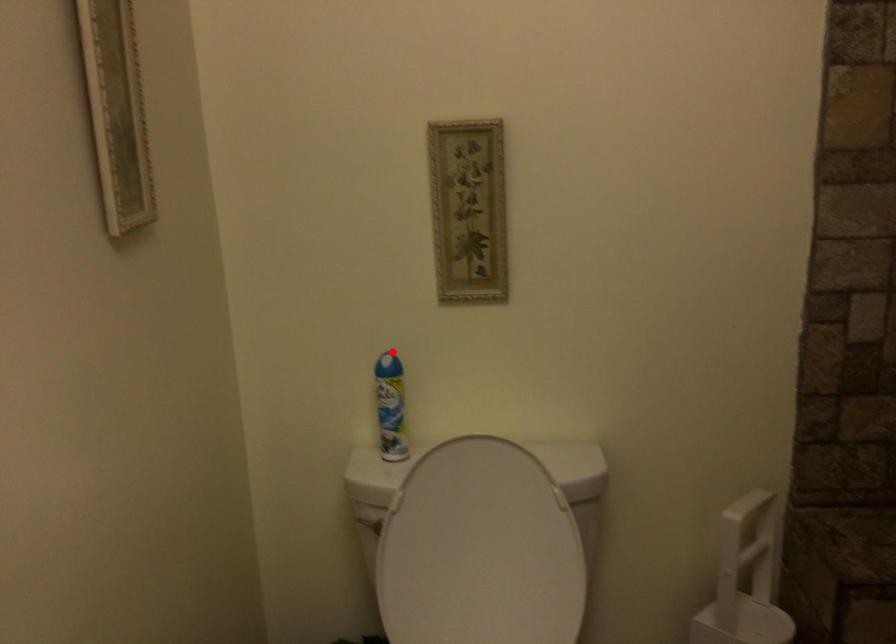
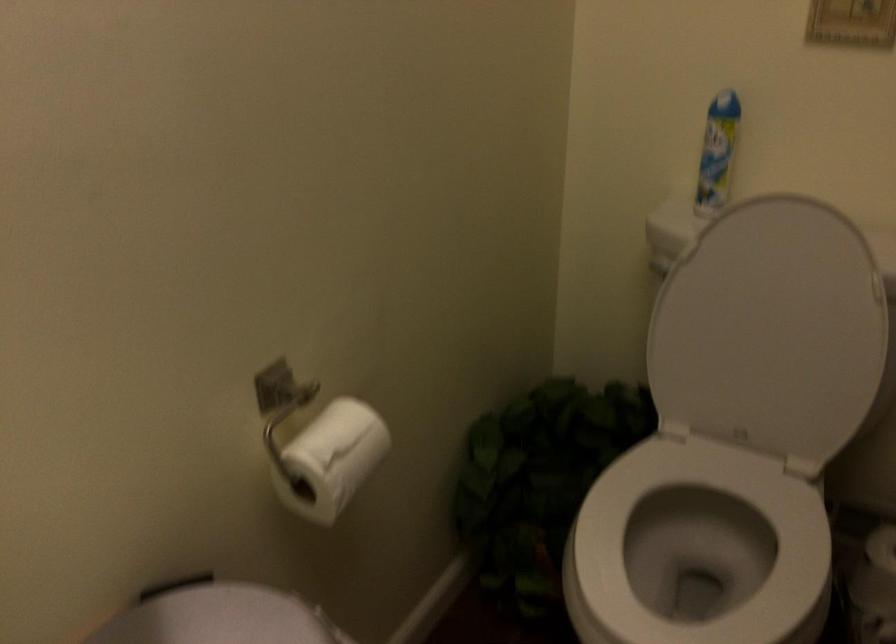
Question: I am providing you with two images of the same scene from different viewpoints. Image1 has a red point marked. In image2, the corresponding 3D location appears at what relative position? Reply with the corresponding letter.

Choices:
 (A) Closer
 (B) Farther

Answer: (A)